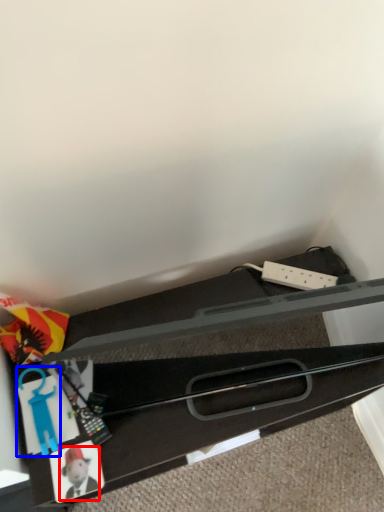
Question: Which object is further to the camera taking this photo, toy (highlighted by a red box) or toy (highlighted by a blue box)?

Choices:
 (A) toy
 (B) toy

Answer: (B)